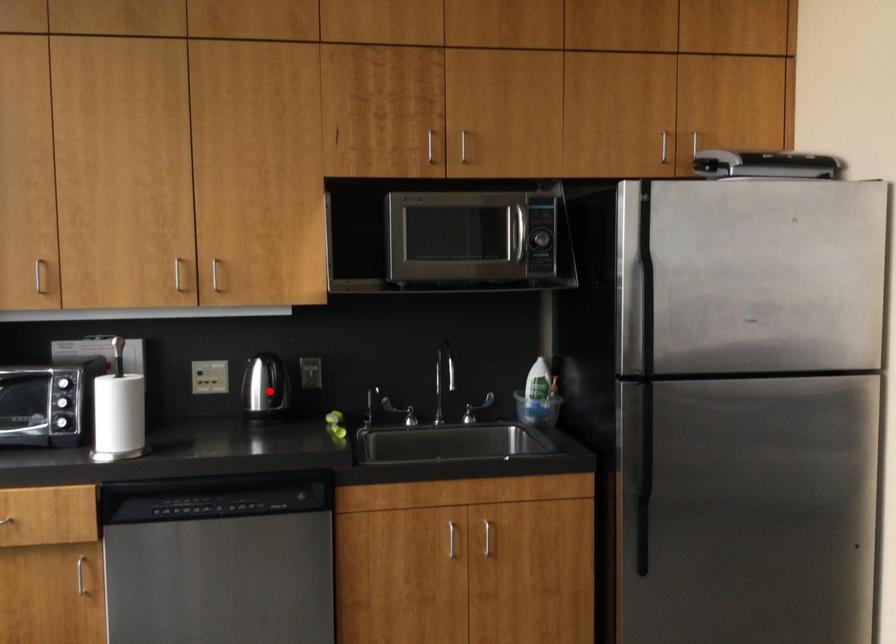
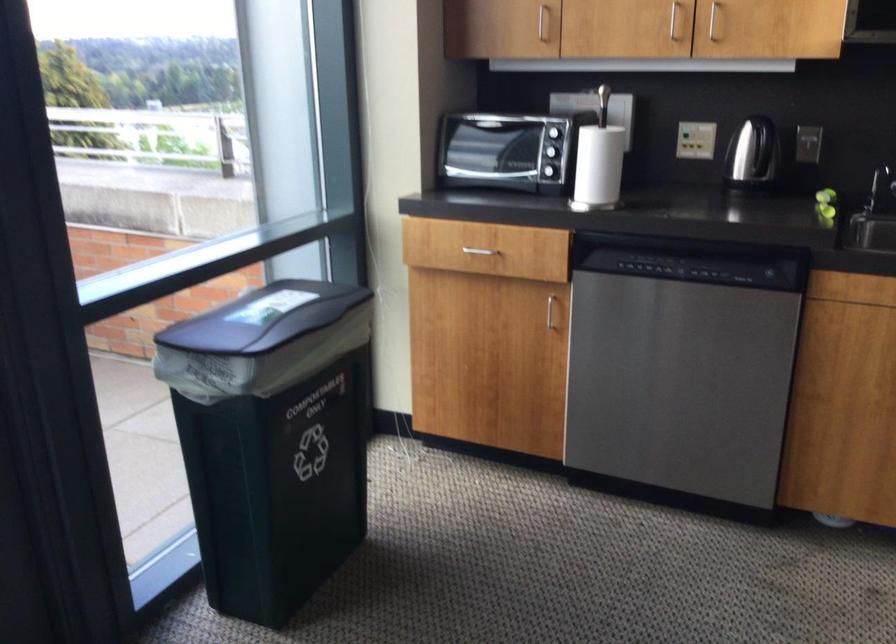
Question: I am providing you with two images of the same scene from different viewpoints. Given a red point in image1, look at the same physical point in image2. Is it:

Choices:
 (A) Closer to the viewpoint
 (B) Farther from the viewpoint

Answer: (A)